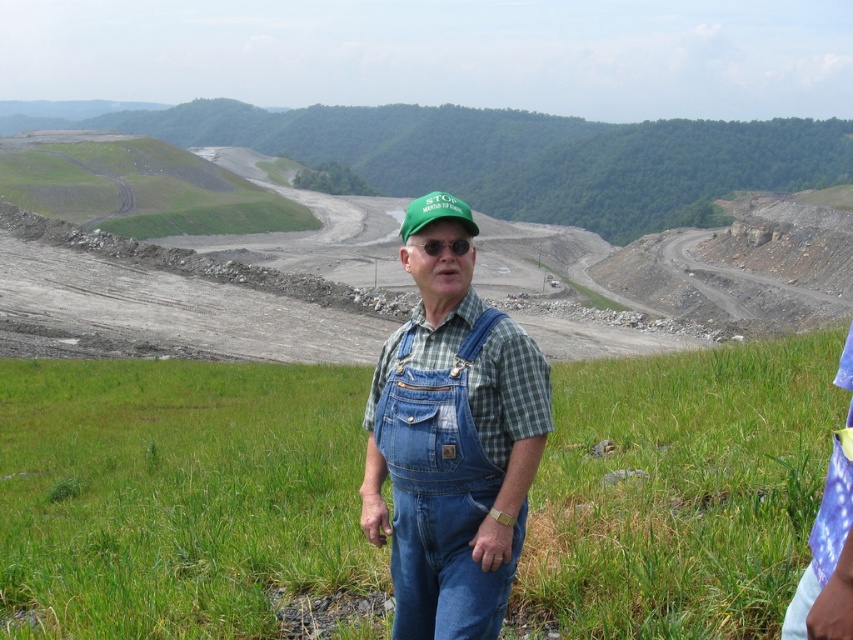
Is green grassy hillside at upper center below green fabric cap at center?

Actually, green grassy hillside at upper center is above green fabric cap at center.

Who is more distant from viewer, (596,138) or (402,241)?

Point (596,138)

Locate an element on the screen. green grassy hillside at upper center is located at coordinates (517, 156).

Which of these two, denim overalls at center or green fabric cap at center, stands taller?

green fabric cap at center is taller.

Which is more to the right, denim overalls at center or green fabric cap at center?

Positioned to the right is denim overalls at center.

What do you see at coordinates (451, 452) in the screenshot? The image size is (853, 640). I see `denim overalls at center` at bounding box center [451, 452].

Where is `denim overalls at center`? Image resolution: width=853 pixels, height=640 pixels. denim overalls at center is located at coordinates (451, 452).

Does green grass at center have a greater width compared to green fabric cap at center?

Correct, the width of green grass at center exceeds that of green fabric cap at center.

Can you confirm if green grass at center is shorter than green fabric cap at center?

Yes, green grass at center is shorter than green fabric cap at center.

Which is in front, point (543, 516) or point (422, 211)?

Point (422, 211)

Find the location of a particular element. The width and height of the screenshot is (853, 640). green grass at center is located at coordinates (177, 496).